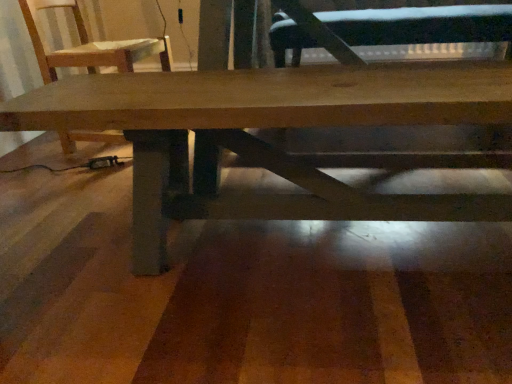
Question: Would you say black leather swivel chair at center is part of wooden chair at upper left's contents?

Choices:
 (A) yes
 (B) no

Answer: (B)

Question: Considering the relative positions of wooden chair at upper left and black leather swivel chair at center in the image provided, is wooden chair at upper left behind black leather swivel chair at center?

Choices:
 (A) yes
 (B) no

Answer: (B)

Question: Is wooden chair at upper left outside black leather swivel chair at center?

Choices:
 (A) no
 (B) yes

Answer: (B)

Question: Considering the relative sizes of wooden chair at upper left and black leather swivel chair at center in the image provided, is wooden chair at upper left smaller than black leather swivel chair at center?

Choices:
 (A) no
 (B) yes

Answer: (B)

Question: Is wooden chair at upper left not near black leather swivel chair at center?

Choices:
 (A) yes
 (B) no

Answer: (B)

Question: Is wooden chair at upper left bigger than black leather swivel chair at center?

Choices:
 (A) no
 (B) yes

Answer: (A)

Question: Considering the relative sizes of wooden chair at upper left and natural wood table at center in the image provided, is wooden chair at upper left taller than natural wood table at center?

Choices:
 (A) no
 (B) yes

Answer: (B)

Question: From a real-world perspective, is wooden chair at upper left over natural wood table at center?

Choices:
 (A) yes
 (B) no

Answer: (A)

Question: Are wooden chair at upper left and natural wood table at center far apart?

Choices:
 (A) no
 (B) yes

Answer: (A)

Question: Can you confirm if wooden chair at upper left is smaller than natural wood table at center?

Choices:
 (A) no
 (B) yes

Answer: (B)

Question: Considering the relative sizes of wooden chair at upper left and natural wood table at center in the image provided, is wooden chair at upper left bigger than natural wood table at center?

Choices:
 (A) no
 (B) yes

Answer: (A)

Question: Is the position of wooden chair at upper left less distant than that of natural wood table at center?

Choices:
 (A) no
 (B) yes

Answer: (A)

Question: Is black leather swivel chair at center looking in the opposite direction of wooden chair at upper left?

Choices:
 (A) no
 (B) yes

Answer: (A)